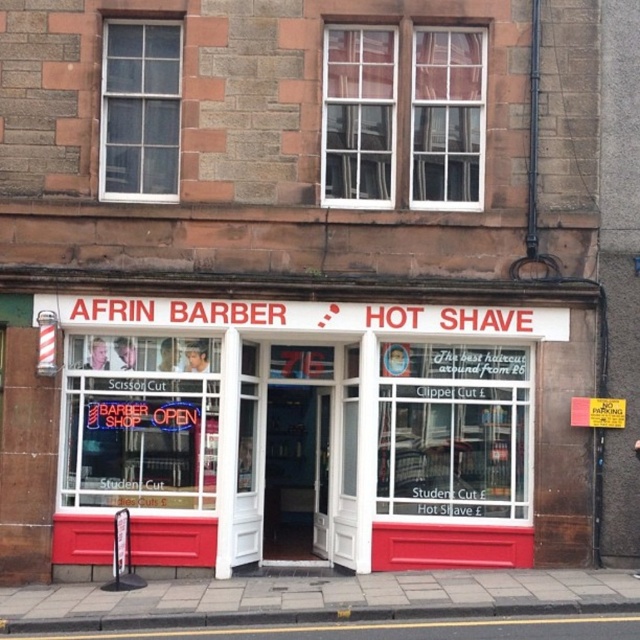
From the picture: You are a delivery person approaching the entrance of the barbershop. You need to place a package on the surface that is wider. Which surface should you choose between the matte glass storefront at center and the concrete at lower center?

The concrete at lower center is wider than the matte glass storefront at center, so you should place the package on the concrete at lower center.

You are a customer standing in front of the barbershop. You notice the matte glass storefront at center and the concrete at lower center. Which object is bigger in size?

The matte glass storefront at center has a larger size compared to concrete at lower center, so the matte glass storefront at center is bigger.